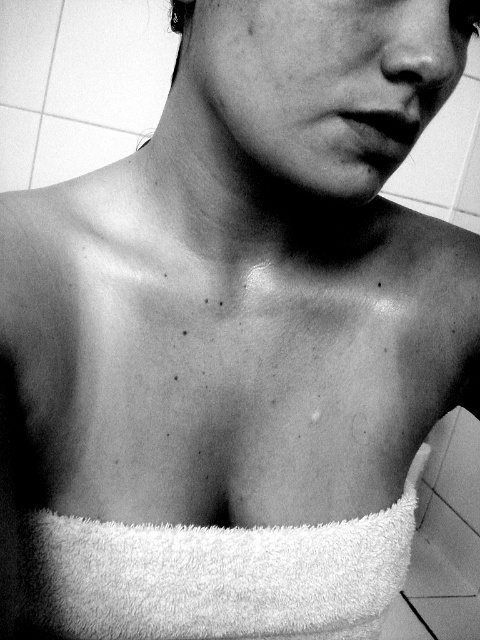
Question: Does white fluffy towel at center have a greater width compared to smooth skin at center?

Choices:
 (A) yes
 (B) no

Answer: (A)

Question: Does white fluffy towel at center appear on the left side of smooth skin at center?

Choices:
 (A) yes
 (B) no

Answer: (A)

Question: Which of the following is the farthest from the observer?

Choices:
 (A) (455, 36)
 (B) (301, 529)

Answer: (B)

Question: Where is white fluffy towel at center located in relation to smooth skin at center in the image?

Choices:
 (A) left
 (B) right

Answer: (A)